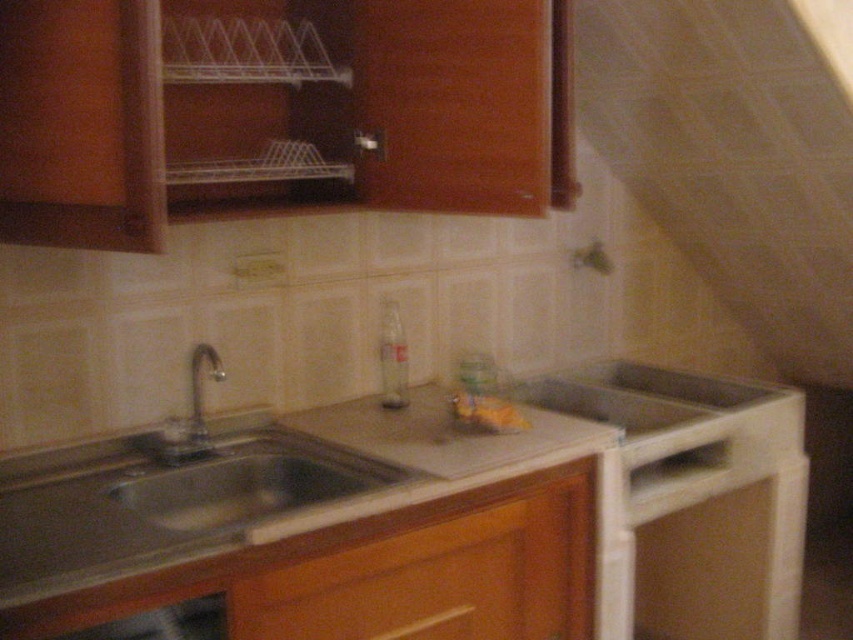
Consider the image. Does smooth white countertop at center appear over silver metallic faucet at sink left?

Actually, smooth white countertop at center is below silver metallic faucet at sink left.

What do you see at coordinates (328, 529) in the screenshot?
I see `smooth white countertop at center` at bounding box center [328, 529].

Where is `smooth white countertop at center`? The width and height of the screenshot is (853, 640). smooth white countertop at center is located at coordinates (328, 529).

Where is `smooth white countertop at center`? The height and width of the screenshot is (640, 853). smooth white countertop at center is located at coordinates (328, 529).

Does white matte exhaust hood at upper right appear on the left side of silver metallic faucet at sink left?

In fact, white matte exhaust hood at upper right is to the right of silver metallic faucet at sink left.

Is white matte exhaust hood at upper right in front of silver metallic faucet at sink left?

Yes, white matte exhaust hood at upper right is closer to the viewer.

The height and width of the screenshot is (640, 853). Find the location of `white matte exhaust hood at upper right`. white matte exhaust hood at upper right is located at coordinates (733, 157).

Locate an element on the screen. The height and width of the screenshot is (640, 853). white matte exhaust hood at upper right is located at coordinates (x=733, y=157).

Does wooden drawer at lower center appear over silver metallic faucet at sink left?

No, wooden drawer at lower center is not above silver metallic faucet at sink left.

Between point (437, 554) and point (193, 365), which one is positioned in front?

Point (437, 554) is more forward.

Who is more forward, [352,637] or [196,388]?

Point [352,637] is more forward.

Where is `wooden drawer at lower center`? This screenshot has height=640, width=853. wooden drawer at lower center is located at coordinates (440, 577).